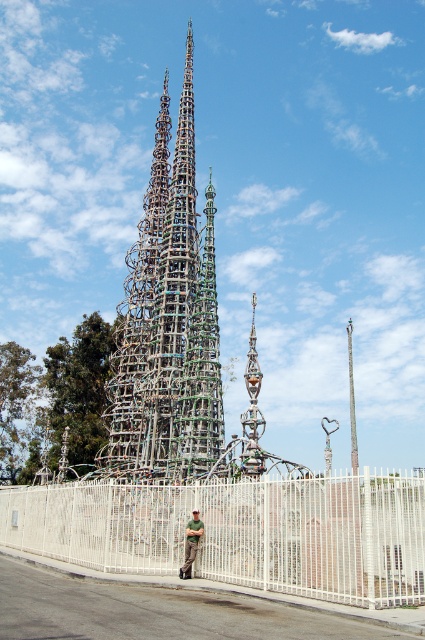
Question: Which point is farther from the camera taking this photo?

Choices:
 (A) (19, 496)
 (B) (167, 394)
 (C) (181, 572)
 (D) (98, 401)

Answer: (D)

Question: Which object is closer to the camera taking this photo?

Choices:
 (A) white metal fence at lower center
 (B) green leafy tree at center
 (C) green leafy tree at left

Answer: (A)

Question: Which object is positioned closest to the green leafy tree at left?

Choices:
 (A) green leafy tree at center
 (B) multicolored metal sculpture at center
 (C) green matte shirt at center

Answer: (A)

Question: Can you confirm if multicolored metal sculpture at center is positioned below green matte shirt at center?

Choices:
 (A) yes
 (B) no

Answer: (B)

Question: Where is green leafy tree at left located in relation to green matte shirt at center in the image?

Choices:
 (A) left
 (B) right

Answer: (A)

Question: Is multicolored metal sculpture at center to the right of green leafy tree at left from the viewer's perspective?

Choices:
 (A) yes
 (B) no

Answer: (A)